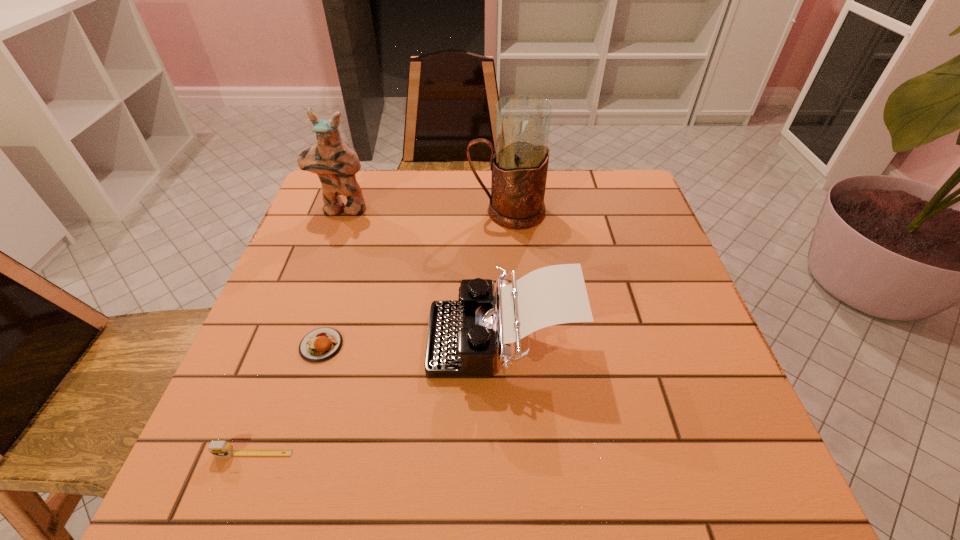
Find the location of a particular element. Image resolution: width=960 pixels, height=540 pixels. object at the far left corner is located at coordinates (333, 160).

You are a GUI agent. You are given a task and a screenshot of the screen. Output one action in this format:
    pyautogui.click(x=<x>, y=<y>)
    Task: Click on the object at the near left corner
    
    Given the screenshot: What is the action you would take?
    pyautogui.click(x=217, y=448)

Where is `vacant region at the far edge of the desktop`? The height and width of the screenshot is (540, 960). vacant region at the far edge of the desktop is located at coordinates (551, 178).

In order to click on vacant space at the near edge of the desktop in this screenshot , I will do `click(598, 484)`.

Where is `free space at the left edge`? free space at the left edge is located at coordinates (294, 293).

At what (x,y) coordinates should I click in order to perform the action: click on vacant space at the right edge of the desktop. Please return your answer as a coordinate pair (x, y). Looking at the image, I should click on (718, 401).

Locate an element on the screen. The image size is (960, 540). free space at the far left corner is located at coordinates (370, 188).

You are a GUI agent. You are given a task and a screenshot of the screen. Output one action in this format:
    pyautogui.click(x=<x>, y=<y>)
    Task: Click on the vacant space at the near left corner of the desktop
    
    Given the screenshot: What is the action you would take?
    pyautogui.click(x=207, y=481)

At what (x,y) coordinates should I click in order to perform the action: click on vacant space at the near right corner. Please return your answer as a coordinate pair (x, y). The image size is (960, 540). Looking at the image, I should click on (674, 447).

Locate an element on the screen. free space between the shortest object and the nearest object is located at coordinates tap(287, 399).